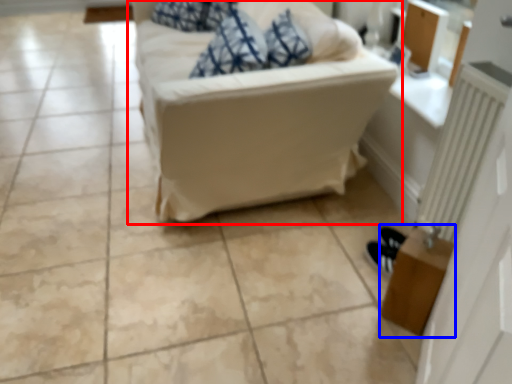
Question: Which point is further to the camera, studio couch (highlighted by a red box) or table (highlighted by a blue box)?

Choices:
 (A) studio couch
 (B) table

Answer: (A)